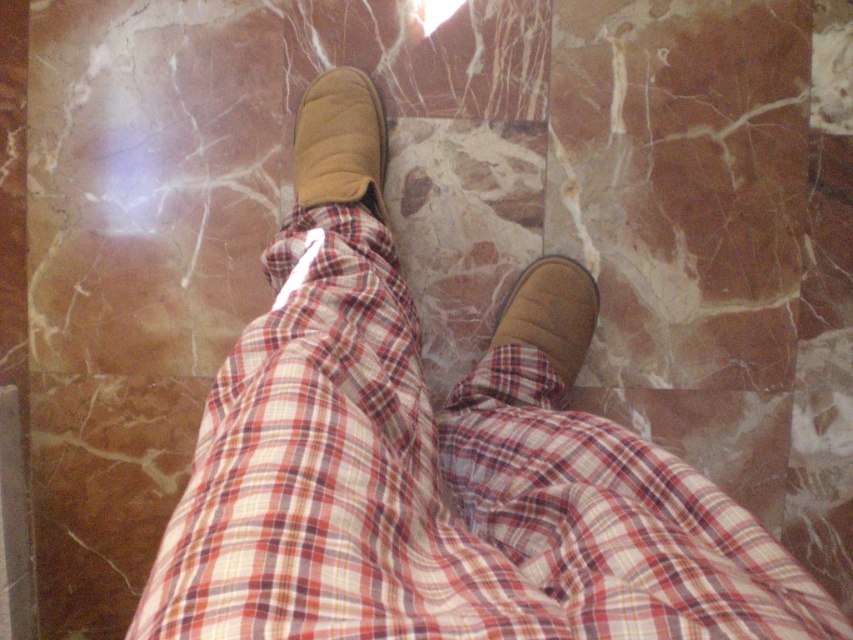
Question: Is plaid fabric at center to the left of brown suede boot at center from the viewer's perspective?

Choices:
 (A) yes
 (B) no

Answer: (B)

Question: Which point is closer to the camera taking this photo?

Choices:
 (A) (276, 252)
 (B) (341, 108)

Answer: (A)

Question: Can you confirm if plaid fabric at center is smaller than brown suede slipper at lower right?

Choices:
 (A) yes
 (B) no

Answer: (B)

Question: Can you confirm if plaid fabric at center is positioned to the left of brown suede boot at center?

Choices:
 (A) yes
 (B) no

Answer: (B)

Question: Which of the following is the farthest from the observer?

Choices:
 (A) brown suede boot at center
 (B) brown suede slipper at lower right

Answer: (B)

Question: Which point is farther from the camera taking this photo?

Choices:
 (A) (497, 314)
 (B) (343, 164)
 (C) (683, 506)

Answer: (A)